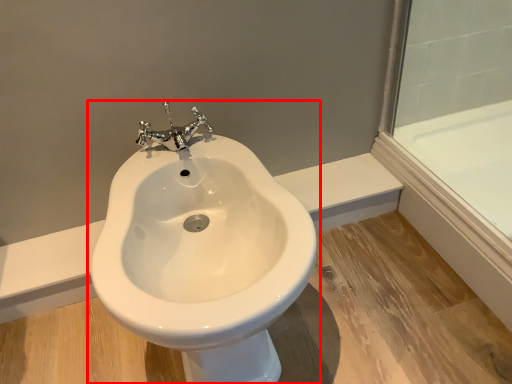
Question: From the image's perspective, considering the relative positions of toilet (annotated by the red box) and glass door in the image provided, where is toilet (annotated by the red box) located with respect to the staircase?

Choices:
 (A) below
 (B) above

Answer: (A)